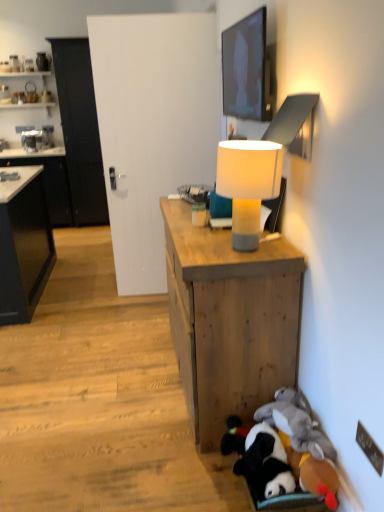
This screenshot has width=384, height=512. Identify the location of free space underneath white fabric lampshade at center (from a real-world perspective). (239, 250).